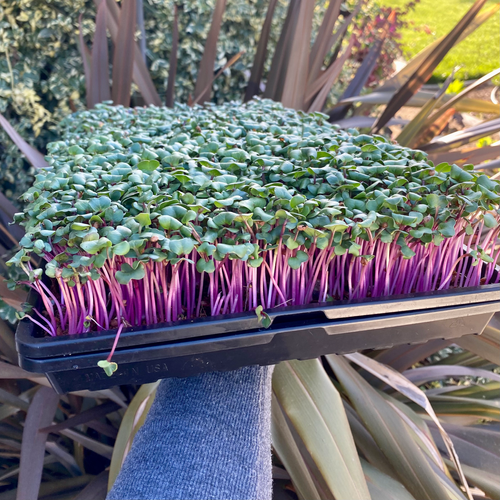
Image resolution: width=500 pixels, height=500 pixels. Find the location of `light hitting the tray`. light hitting the tray is located at coordinates (442, 302).